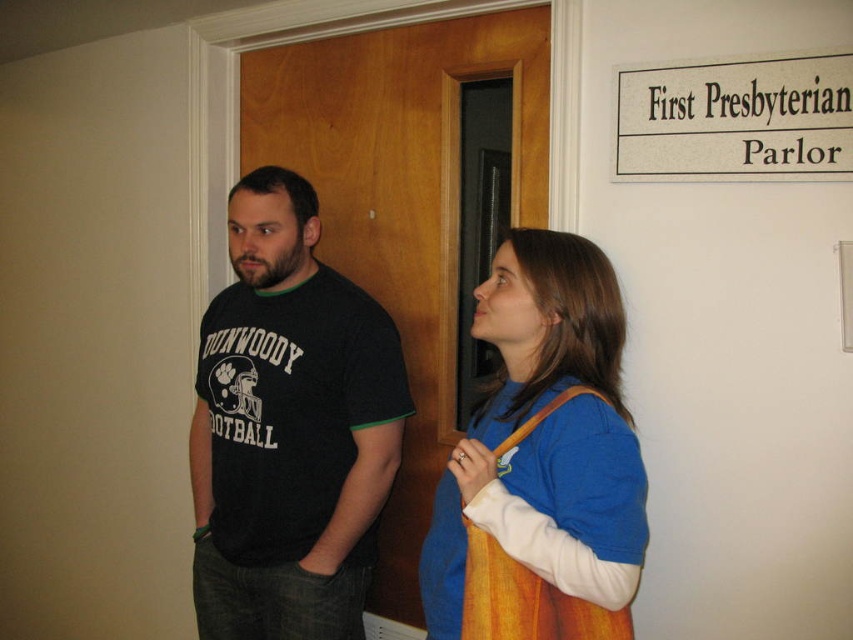
Is black cotton t-shirt at center closer to the viewer compared to blue fabric shirt at center?

No, black cotton t-shirt at center is further to the viewer.

Does black cotton t-shirt at center have a greater height compared to blue fabric shirt at center?

Correct, black cotton t-shirt at center is much taller as blue fabric shirt at center.

Where is `black cotton t-shirt at center`? black cotton t-shirt at center is located at coordinates (289, 428).

Looking at this image, which is above, blue fabric shirt at center or brown leather apron at center?

blue fabric shirt at center is higher up.

Does blue fabric shirt at center have a greater height compared to brown leather apron at center?

Correct, blue fabric shirt at center is much taller as brown leather apron at center.

Is point (627, 564) farther from viewer compared to point (560, 600)?

No, (627, 564) is in front of (560, 600).

Where is `blue fabric shirt at center`? The image size is (853, 640). blue fabric shirt at center is located at coordinates (543, 461).

Is point (450, 234) positioned in front of point (473, 554)?

That is False.

Is wooden door at center thinner than brown leather apron at center?

No.

Find the location of a particular element. Image resolution: width=853 pixels, height=640 pixels. wooden door at center is located at coordinates (404, 205).

Where is `wooden door at center`? wooden door at center is located at coordinates (404, 205).